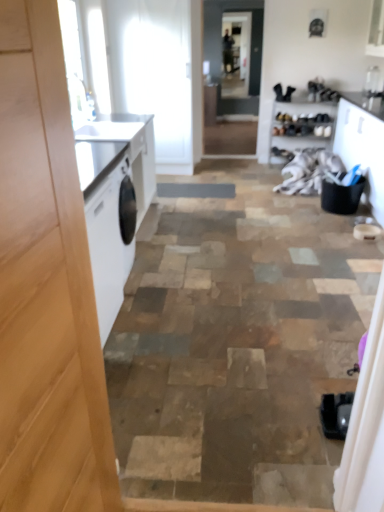
Question: Is there a large distance between clear glass screen door at center, arranged as the 1th screen door when viewed from the top, and white fabric at center?

Choices:
 (A) no
 (B) yes

Answer: (B)

Question: Does clear glass screen door at center, which is the 2th screen door from front to back, have a lesser width compared to white fabric at center?

Choices:
 (A) yes
 (B) no

Answer: (A)

Question: Can you confirm if clear glass screen door at center, which is the 2th screen door from front to back, is smaller than white fabric at center?

Choices:
 (A) yes
 (B) no

Answer: (A)

Question: From a real-world perspective, is clear glass screen door at center, which is the 2th screen door from front to back, on top of white fabric at center?

Choices:
 (A) yes
 (B) no

Answer: (A)

Question: Does clear glass screen door at center, which is the 2th screen door from front to back, lie in front of white fabric at center?

Choices:
 (A) no
 (B) yes

Answer: (A)

Question: From the image's perspective, relative to white fabric at center, is clear glass screen door at center, the 1th screen door viewed from the back, above or below?

Choices:
 (A) below
 (B) above

Answer: (B)

Question: From a real-world perspective, is clear glass screen door at center, which ranks as the 2th screen door in bottom-to-top order, positioned above or below white fabric at center?

Choices:
 (A) below
 (B) above

Answer: (B)

Question: Which is correct: clear glass screen door at center, arranged as the 1th screen door when viewed from the top, is inside white fabric at center, or outside of it?

Choices:
 (A) inside
 (B) outside

Answer: (B)

Question: Is clear glass screen door at center, the 1th screen door viewed from the back, wider or thinner than white fabric at center?

Choices:
 (A) thin
 (B) wide

Answer: (A)

Question: In terms of width, does clear glass screen door at center, which ranks as the 2th screen door in bottom-to-top order, look wider or thinner when compared to clear glass screen door at center, arranged as the second screen door when viewed from the back?

Choices:
 (A) wide
 (B) thin

Answer: (B)

Question: Looking at the image, does clear glass screen door at center, which is the 2th screen door from front to back, seem bigger or smaller compared to clear glass screen door at center, which ranks as the first screen door in front-to-back order?

Choices:
 (A) small
 (B) big

Answer: (A)

Question: In the image, is clear glass screen door at center, the 1th screen door viewed from the back, positioned in front of or behind clear glass screen door at center, which ranks as the first screen door in front-to-back order?

Choices:
 (A) front
 (B) behind

Answer: (B)

Question: Is clear glass screen door at center, which ranks as the 2th screen door in bottom-to-top order, spatially inside clear glass screen door at center, which is the first screen door in bottom-to-top order, or outside of it?

Choices:
 (A) outside
 (B) inside

Answer: (A)

Question: Looking at their shapes, would you say clear glass screen door at center, which ranks as the 2th screen door in bottom-to-top order, is wider or thinner than wooden shoe rack at upper right?

Choices:
 (A) thin
 (B) wide

Answer: (A)

Question: From the image's perspective, is clear glass screen door at center, arranged as the 1th screen door when viewed from the top, positioned above or below wooden shoe rack at upper right?

Choices:
 (A) above
 (B) below

Answer: (A)